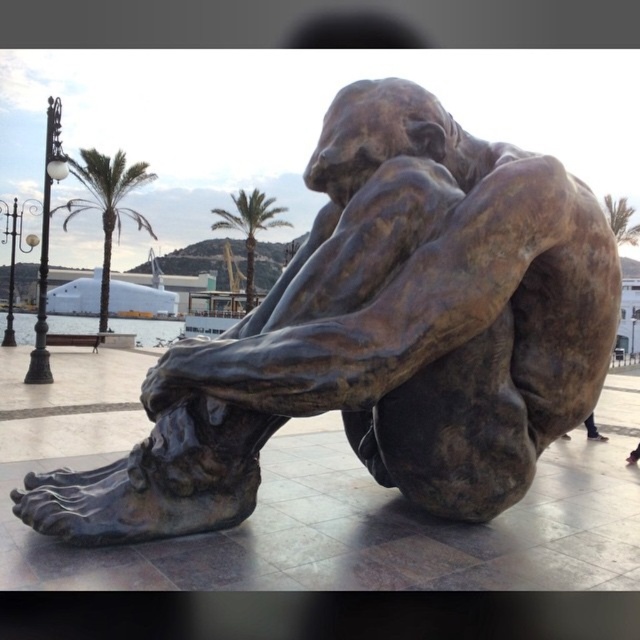
Is green leafy palm tree at upper left wider than green leafy palm tree at upper right?

Incorrect, green leafy palm tree at upper left's width does not surpass green leafy palm tree at upper right's.

Does green leafy palm tree at upper left have a greater height compared to green leafy palm tree at upper right?

No.

Which is behind, point (108, 212) or point (634, 225)?

The point (634, 225) is behind.

The width and height of the screenshot is (640, 640). What are the coordinates of `green leafy palm tree at upper left` in the screenshot? It's located at (106, 204).

Who is more distant from viewer, (237,484) or (100,163)?

Point (100,163)

Can you confirm if bronze statue at center is positioned to the left of green leafy palm tree at upper left?

In fact, bronze statue at center is to the right of green leafy palm tree at upper left.

Is point (428, 380) closer to viewer compared to point (77, 204)?

Yes, it is in front of point (77, 204).

You are a GUI agent. You are given a task and a screenshot of the screen. Output one action in this format:
    pyautogui.click(x=<x>, y=<y>)
    Task: Click on the bronze statue at center
    The image size is (640, 640).
    Given the screenshot: What is the action you would take?
    pyautogui.click(x=380, y=336)

Is green leafy palm tree at center above green leafy palm tree at upper right?

Indeed, green leafy palm tree at center is positioned over green leafy palm tree at upper right.

Is green leafy palm tree at center shorter than green leafy palm tree at upper right?

Indeed, green leafy palm tree at center has a lesser height compared to green leafy palm tree at upper right.

Between point (237, 212) and point (602, 204), which one is positioned in front?

Point (602, 204) is in front.

Where is `green leafy palm tree at center`? green leafy palm tree at center is located at coordinates (250, 227).